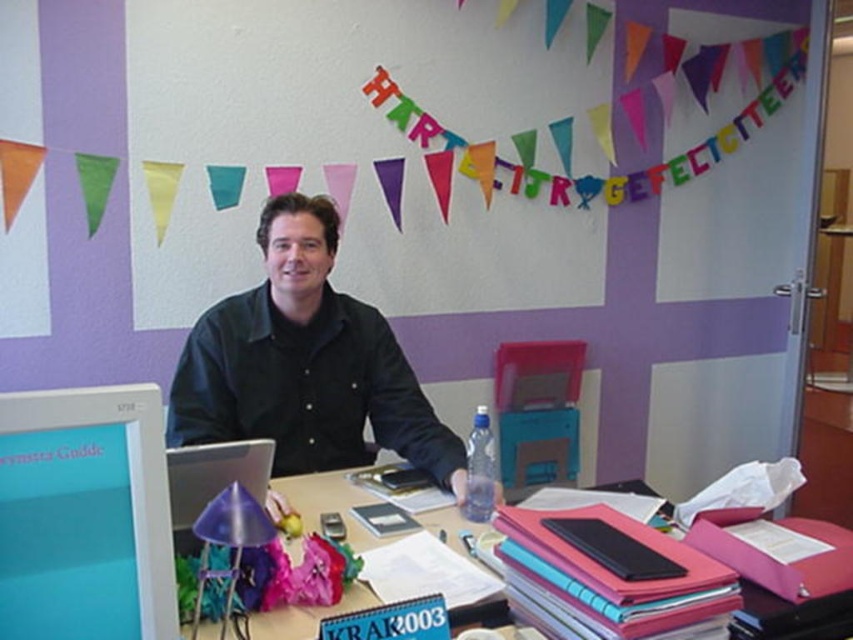
Question: Can you confirm if matte plastic computer monitor at left is wider than pink plastic folders at center?

Choices:
 (A) yes
 (B) no

Answer: (B)

Question: Which of the following is the closest to the observer?

Choices:
 (A) pink plastic folders at center
 (B) black matte shirt at center
 (C) matte plastic computer monitor at left

Answer: (C)

Question: Which point appears closest to the camera in this image?

Choices:
 (A) (761, 586)
 (B) (120, 566)

Answer: (B)

Question: Which object is the closest to the matte plastic computer monitor at left?

Choices:
 (A) black matte shirt at center
 (B) pink plastic folders at center

Answer: (B)

Question: Is matte plastic computer monitor at left positioned at the back of pink plastic folders at center?

Choices:
 (A) no
 (B) yes

Answer: (A)

Question: Does black matte shirt at center have a smaller size compared to matte plastic computer monitor at left?

Choices:
 (A) yes
 (B) no

Answer: (B)